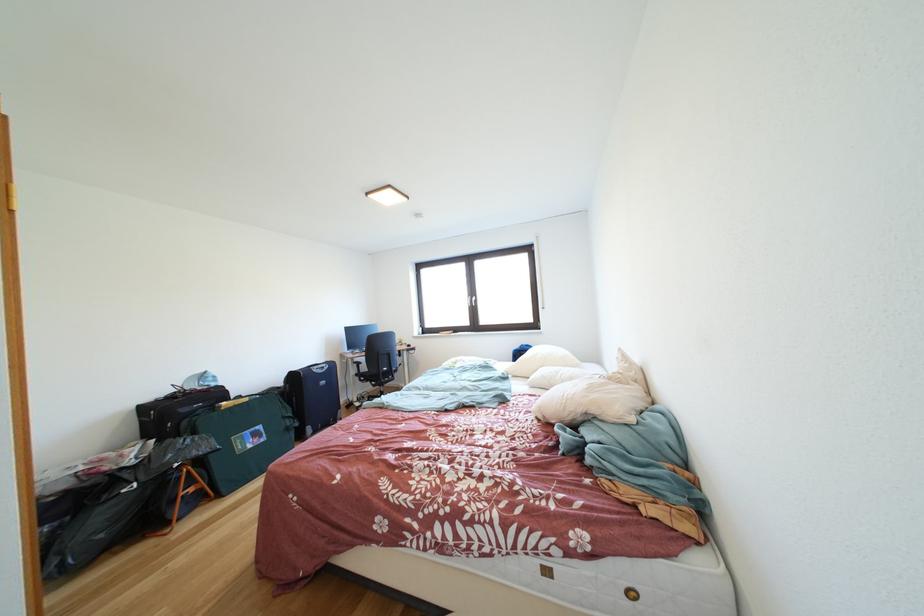
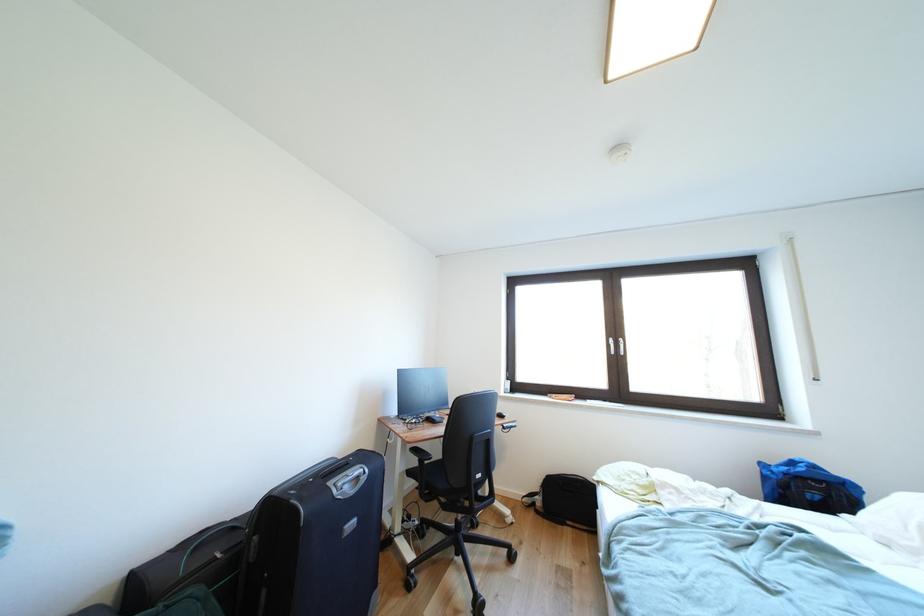
In a continuous first-person perspective shot, in which direction is the camera moving?

The cameraman walked toward left, forward.